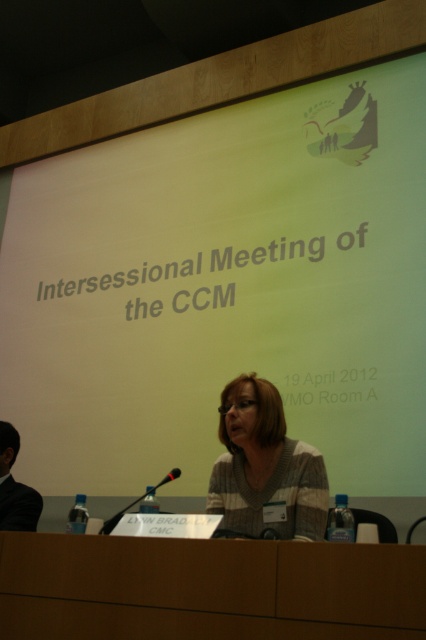
Is brown wood table at center positioned at the back of knit sweater at center?

No, brown wood table at center is closer to the viewer.

What do you see at coordinates (207, 588) in the screenshot?
I see `brown wood table at center` at bounding box center [207, 588].

Which is behind, point (397, 582) or point (296, 497)?

The point (296, 497) is more distant.

Identify the location of brown wood table at center. (207, 588).

Is green matte projection screen at upper center above black suit at left?

Correct, green matte projection screen at upper center is located above black suit at left.

Is point (397, 410) less distant than point (6, 518)?

No.

Who is more distant from viewer, (23, 440) or (11, 451)?

The point (23, 440) is more distant.

Find the location of a particular element. green matte projection screen at upper center is located at coordinates (224, 289).

Looking at this image, which of these two, black suit at left or black plastic microphone at center, stands taller?

black suit at left is taller.

Find the location of a particular element. This screenshot has height=640, width=426. black suit at left is located at coordinates (14, 486).